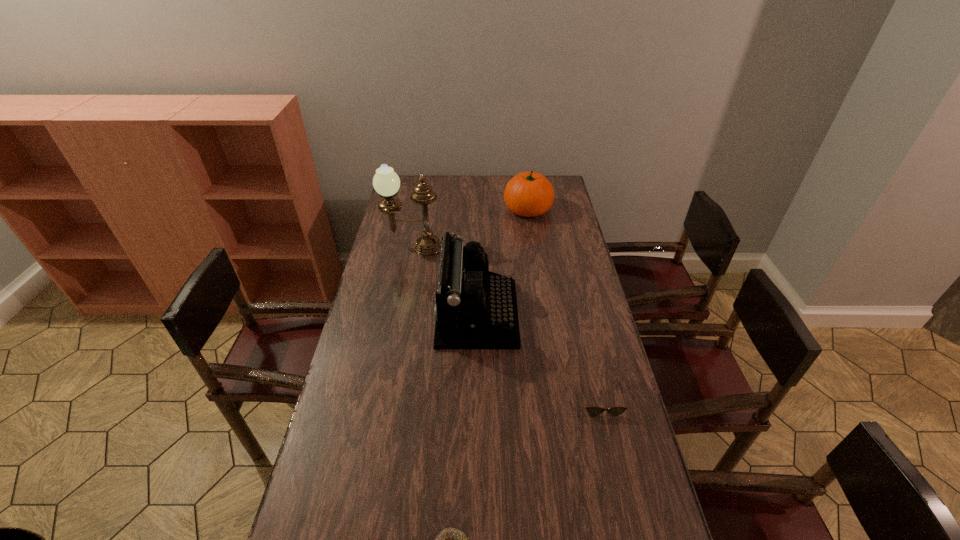
Locate an element on the screen. The height and width of the screenshot is (540, 960). free space located on the left of the pumpkin is located at coordinates (474, 209).

This screenshot has height=540, width=960. I want to click on free spot located 0.150m at the front view of the spectacles, so click(616, 465).

Where is `object situated at the far edge`? object situated at the far edge is located at coordinates (528, 194).

This screenshot has height=540, width=960. In order to click on object present at the left edge in this screenshot , I will do `click(386, 182)`.

Where is `pumpkin that is at the right edge`? The width and height of the screenshot is (960, 540). pumpkin that is at the right edge is located at coordinates (528, 194).

Locate an element on the screen. Image resolution: width=960 pixels, height=540 pixels. spectacles that is at the right edge is located at coordinates (592, 411).

Find the location of a particular element. The width and height of the screenshot is (960, 540). object that is at the far right corner is located at coordinates (528, 194).

In order to click on vacant space at the left edge of the desktop in this screenshot , I will do `click(400, 278)`.

Find the location of a particular element. vacant space at the right edge of the desktop is located at coordinates (587, 458).

Locate an element on the screen. free point between the farthest object and the third farthest object is located at coordinates (502, 261).